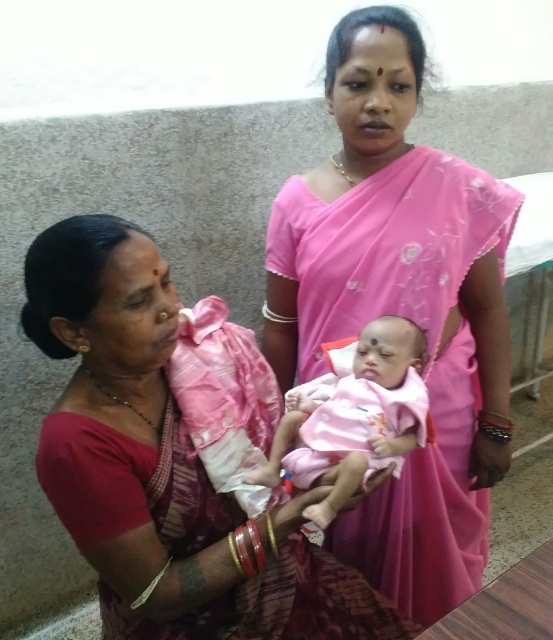
In the scene described, there are a matte pink saree at center and a pink fabric baby at center. Which object is positioned further to the left?

The matte pink saree at center is positioned to the left of the pink fabric baby at center, so it is further to the left.